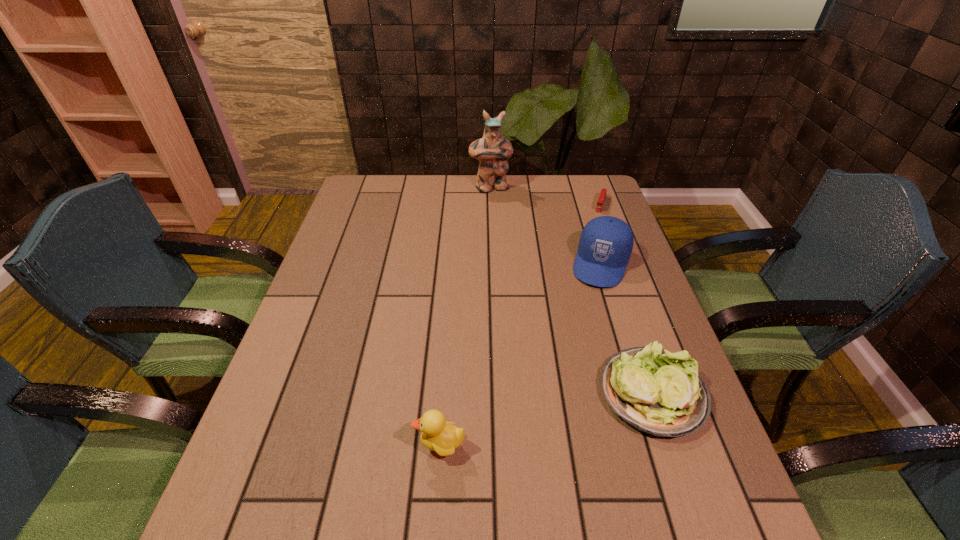
Identify the location of free space at the near edge. (451, 468).

Where is `vacant space at the left edge of the desktop`? vacant space at the left edge of the desktop is located at coordinates (356, 261).

The image size is (960, 540). I want to click on vacant space at the right edge of the desktop, so click(576, 233).

The image size is (960, 540). What are the coordinates of `vacant area at the far right corner of the desktop` in the screenshot? It's located at (594, 189).

Find the location of a particular element. The height and width of the screenshot is (540, 960). vacant space that is in between the tallest object and the third farthest object is located at coordinates (546, 226).

The height and width of the screenshot is (540, 960). What are the coordinates of `vacant area between the second farthest object and the lettuce` in the screenshot? It's located at (627, 299).

The image size is (960, 540). In order to click on unoccupied position between the duckling and the third nearest object in this screenshot , I will do `click(520, 355)`.

The image size is (960, 540). I want to click on vacant space in between the third farthest object and the figurine, so click(x=546, y=226).

I want to click on vacant point located between the shortest object and the duckling, so click(x=520, y=326).

Image resolution: width=960 pixels, height=540 pixels. I want to click on free space between the shortest object and the tallest object, so click(545, 195).